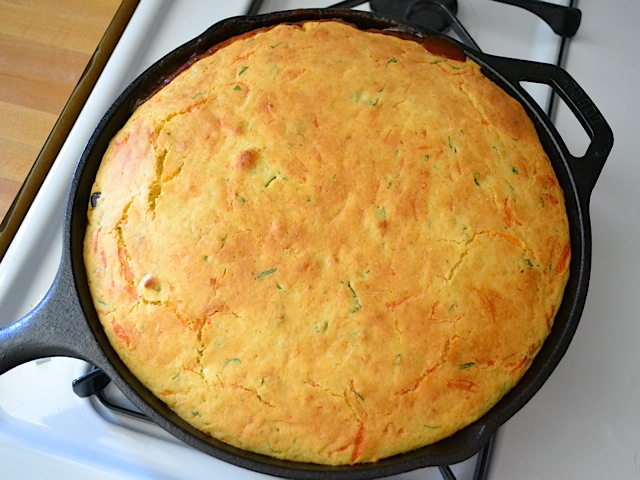
Identify the location of grayish white stove top. Image resolution: width=640 pixels, height=480 pixels. (579, 422).